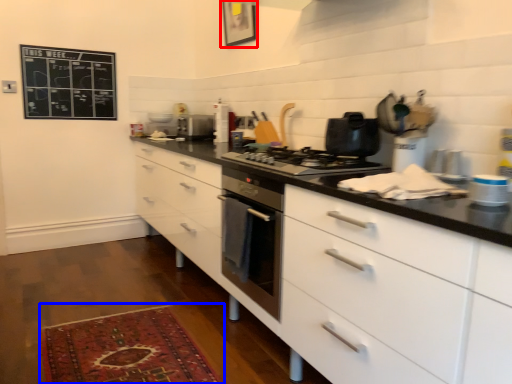
Question: Which point is further to the camera, picture frame (highlighted by a red box) or mat (highlighted by a blue box)?

Choices:
 (A) picture frame
 (B) mat

Answer: (A)